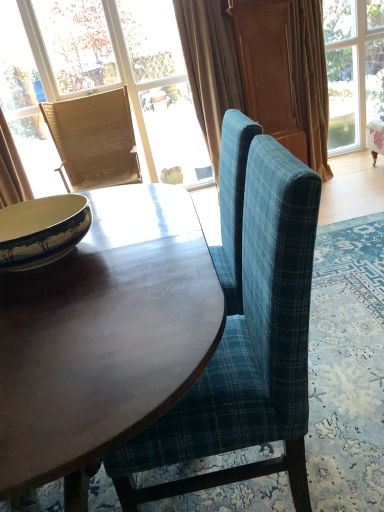
Question: Would you say beige velvet curtain at upper center, which is the 2th curtain in right-to-left order, is outside matte wicker chair at upper left, arranged as the 2th window when viewed from the right?

Choices:
 (A) no
 (B) yes

Answer: (B)

Question: Considering the relative positions of beige velvet curtain at upper center, which is the 2th curtain in right-to-left order, and matte wicker chair at upper left, arranged as the 2th window when viewed from the right, in the image provided, is beige velvet curtain at upper center, which is the 2th curtain in right-to-left order, to the right of matte wicker chair at upper left, arranged as the 2th window when viewed from the right, from the viewer's perspective?

Choices:
 (A) yes
 (B) no

Answer: (A)

Question: Can you confirm if beige velvet curtain at upper center, which is the 2th curtain in right-to-left order, is wider than matte wicker chair at upper left, positioned as the first window in left-to-right order?

Choices:
 (A) no
 (B) yes

Answer: (B)

Question: Can you confirm if beige velvet curtain at upper center, which is the 2th curtain in right-to-left order, is shorter than matte wicker chair at upper left, arranged as the 2th window when viewed from the right?

Choices:
 (A) no
 (B) yes

Answer: (B)

Question: From the image's perspective, is beige velvet curtain at upper center, which is the 2th curtain in right-to-left order, beneath matte wicker chair at upper left, positioned as the first window in left-to-right order?

Choices:
 (A) yes
 (B) no

Answer: (A)

Question: Is beige velvet curtain at upper center, the second curtain from the left, with matte wicker chair at upper left, arranged as the 2th window when viewed from the right?

Choices:
 (A) no
 (B) yes

Answer: (A)

Question: Can we say clear glass window at upper right, which is the second window in left-to-right order, lies outside beige fabric curtain at left, which is the first curtain from left to right?

Choices:
 (A) yes
 (B) no

Answer: (A)

Question: Is clear glass window at upper right, which ranks as the 1th window in right-to-left order, positioned far away from beige fabric curtain at left, which appears as the 3th curtain when viewed from the right?

Choices:
 (A) no
 (B) yes

Answer: (B)

Question: Is clear glass window at upper right, which ranks as the 1th window in right-to-left order, beside beige fabric curtain at left, which is the first curtain from left to right?

Choices:
 (A) no
 (B) yes

Answer: (A)

Question: Can you confirm if clear glass window at upper right, which ranks as the 1th window in right-to-left order, is shorter than beige fabric curtain at left, which appears as the 3th curtain when viewed from the right?

Choices:
 (A) yes
 (B) no

Answer: (B)

Question: Does clear glass window at upper right, which is the second window in left-to-right order, appear on the left side of beige fabric curtain at left, which is the first curtain from left to right?

Choices:
 (A) no
 (B) yes

Answer: (A)

Question: From a real-world perspective, is clear glass window at upper right, which ranks as the 1th window in right-to-left order, over beige fabric curtain at left, which is the first curtain from left to right?

Choices:
 (A) no
 (B) yes

Answer: (A)

Question: Is matte wicker chair at upper left, positioned as the first window in left-to-right order, positioned in front of beige velvet curtain at upper center, the second curtain from the left?

Choices:
 (A) no
 (B) yes

Answer: (A)